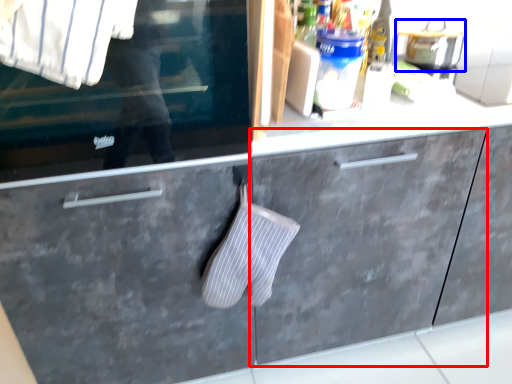
Question: Among these objects, which one is farthest to the camera, cabinetry (highlighted by a red box) or appliance (highlighted by a blue box)?

Choices:
 (A) cabinetry
 (B) appliance

Answer: (B)